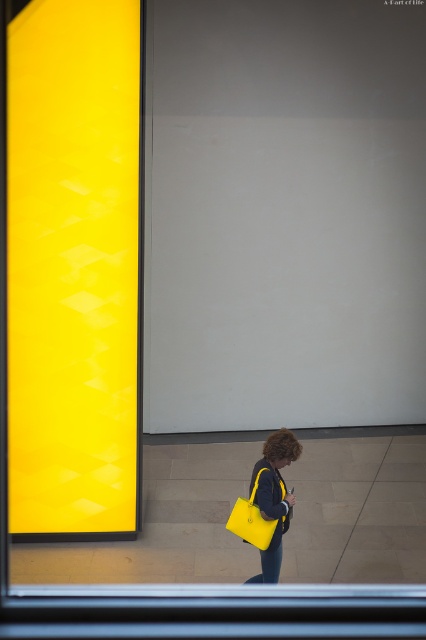
You are a fashion designer observing the scene through the window. You notice two matte yellow bags at lower center. Which one is positioned lower between the matte yellow handbag at lower center and the matte yellow shoulder bag at lower center?

The matte yellow handbag at lower center is positioned lower than the matte yellow shoulder bag at lower center according to the description.